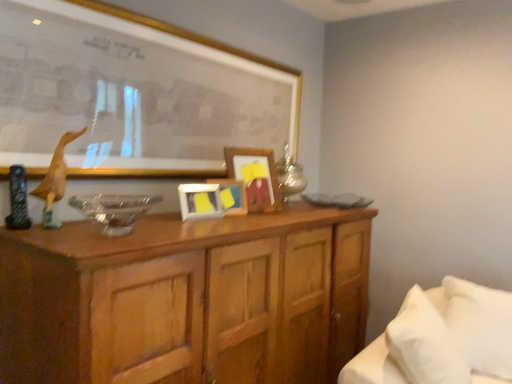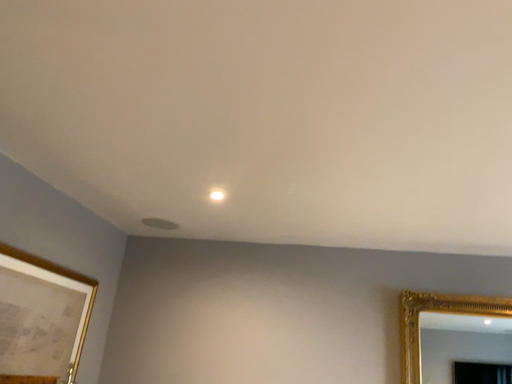
Question: Which way did the camera rotate in the video?

Choices:
 (A) rotated upward
 (B) rotated downward

Answer: (A)